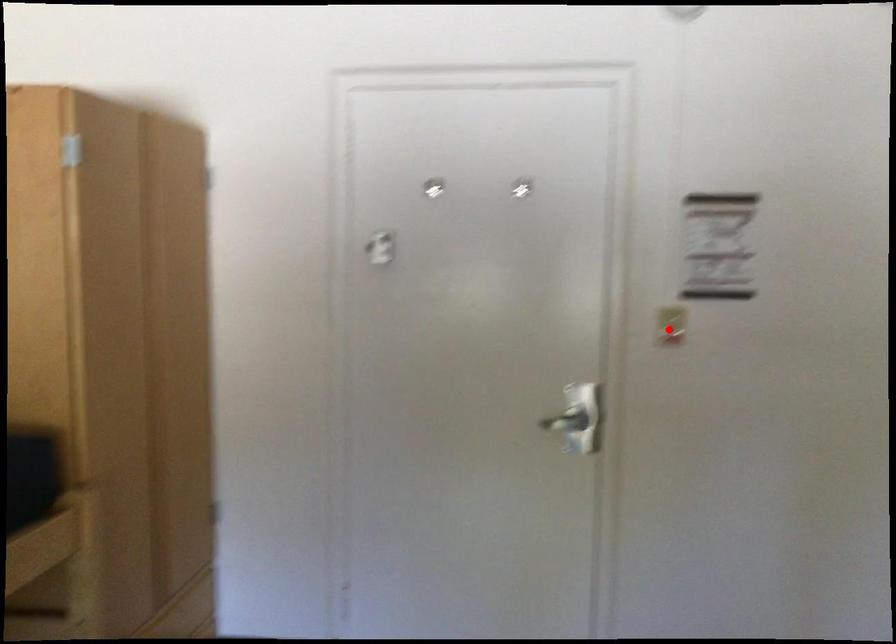
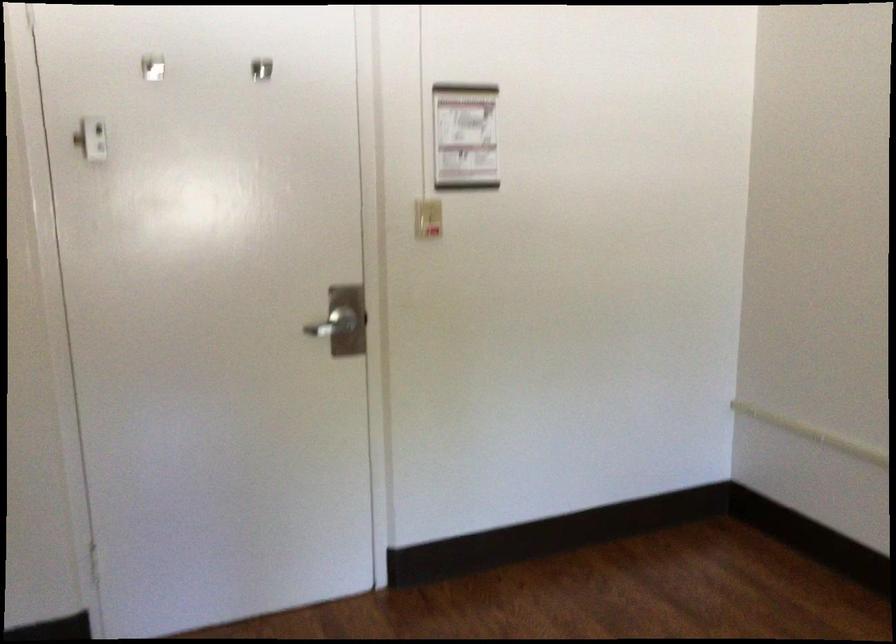
Question: I am providing you with two images of the same scene from different viewpoints. A red point is marked on the first image. Can you still see the location of the red point in image 2?

Choices:
 (A) Yes
 (B) No

Answer: (A)